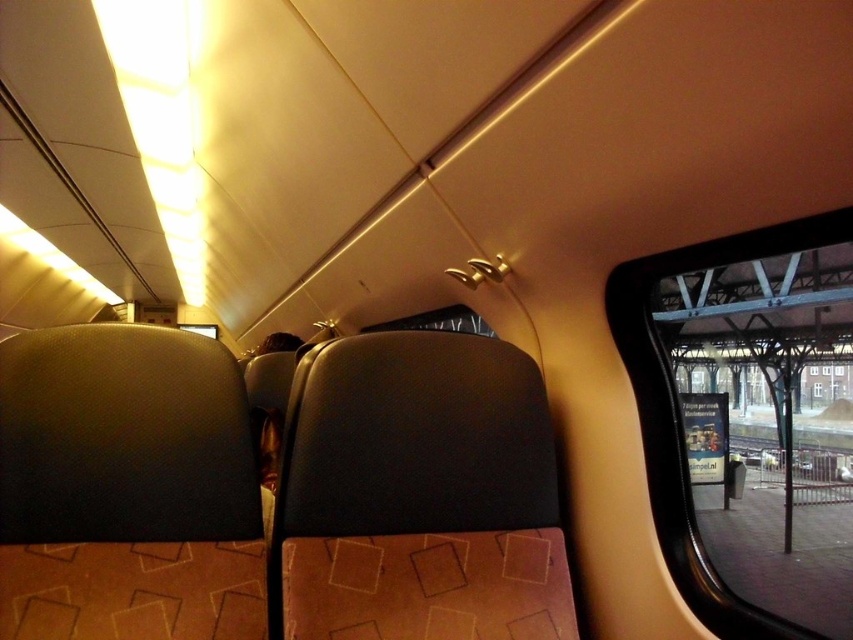
How distant is clear glass window at upper right from transparent glass window at center?

The distance of clear glass window at upper right from transparent glass window at center is 18.57 meters.

Looking at this image, can you confirm if clear glass window at upper right is positioned above transparent glass window at center?

Indeed, clear glass window at upper right is positioned over transparent glass window at center.

Locate an element on the screen. Image resolution: width=853 pixels, height=640 pixels. clear glass window at upper right is located at coordinates (677, 412).